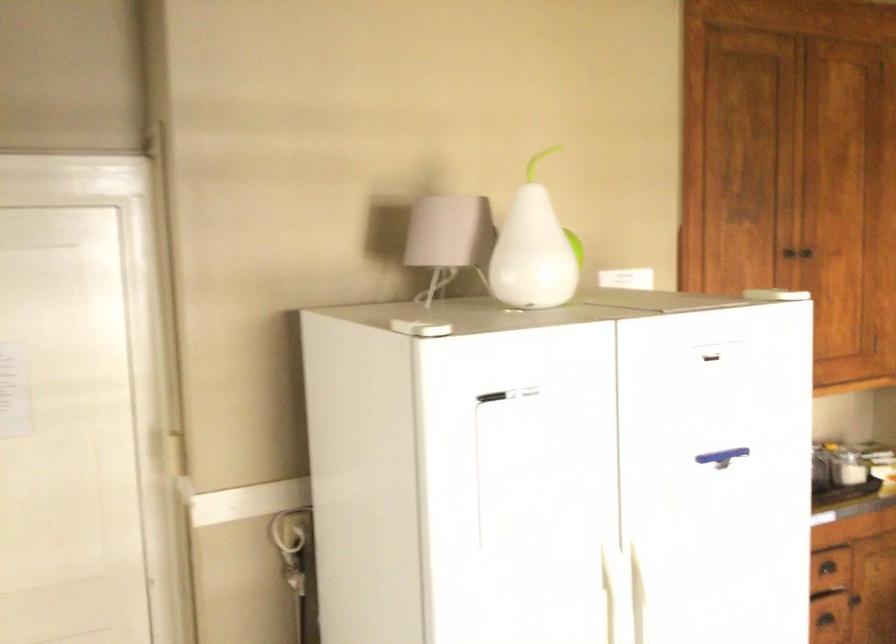
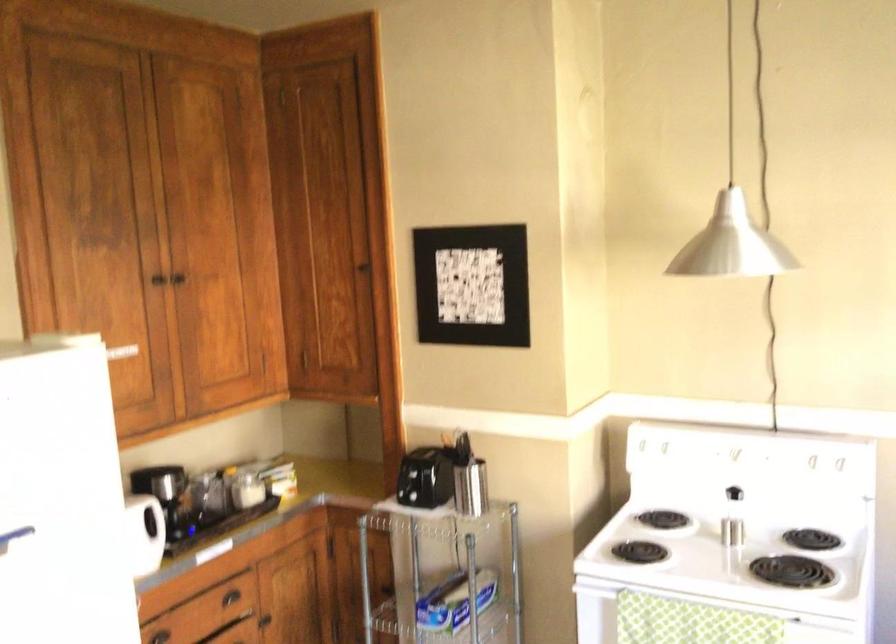
Question: The images are taken continuously from a first-person perspective. In which direction is your viewpoint rotating?

Choices:
 (A) Left
 (B) Right
 (C) Up
 (D) Down

Answer: (B)